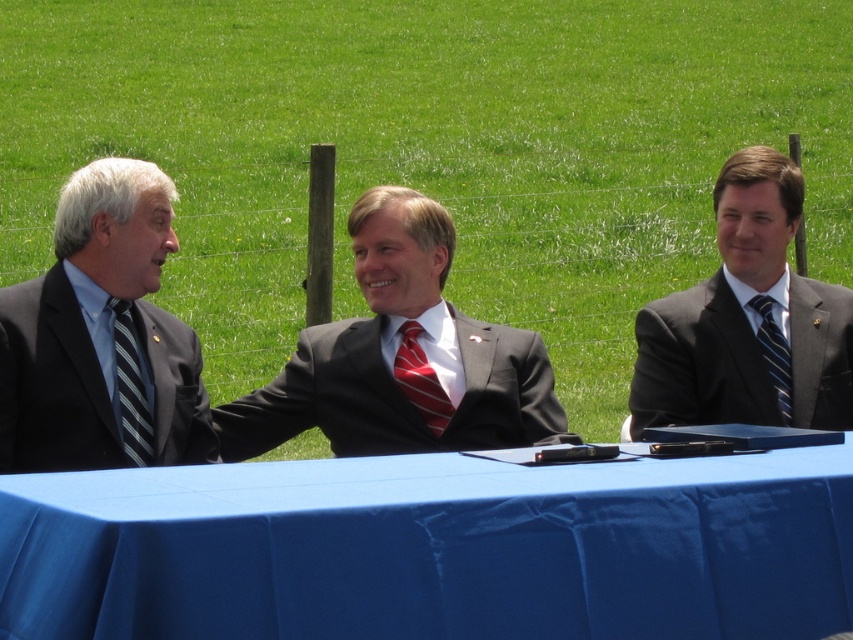
The image size is (853, 640). Describe the element at coordinates (433, 548) in the screenshot. I see `blue fabric table at center` at that location.

Can you confirm if blue fabric table at center is bigger than matte black suit at center?

Correct, blue fabric table at center is larger in size than matte black suit at center.

I want to click on blue fabric table at center, so click(433, 548).

Which of these two, red striped tie at center or blue striped tie at right, stands shorter?

red striped tie at center is shorter.

The height and width of the screenshot is (640, 853). Describe the element at coordinates (421, 380) in the screenshot. I see `red striped tie at center` at that location.

Between point (415, 406) and point (757, 310), which one is positioned in front?

Point (415, 406) is in front.

Identify the location of red striped tie at center. This screenshot has height=640, width=853. (421, 380).

How distant is matte gray suit at left from matte gray suit at right?

matte gray suit at left and matte gray suit at right are 5.51 feet apart from each other.

Which is above, matte gray suit at left or matte gray suit at right?

matte gray suit at left is higher up.

What do you see at coordinates (102, 337) in the screenshot? The height and width of the screenshot is (640, 853). I see `matte gray suit at left` at bounding box center [102, 337].

Locate an element on the screen. matte gray suit at left is located at coordinates (102, 337).